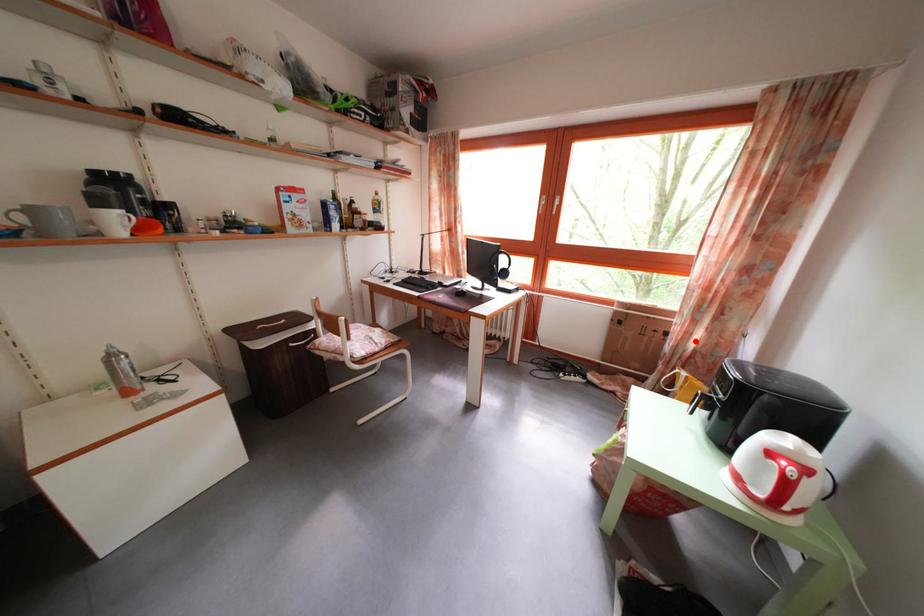
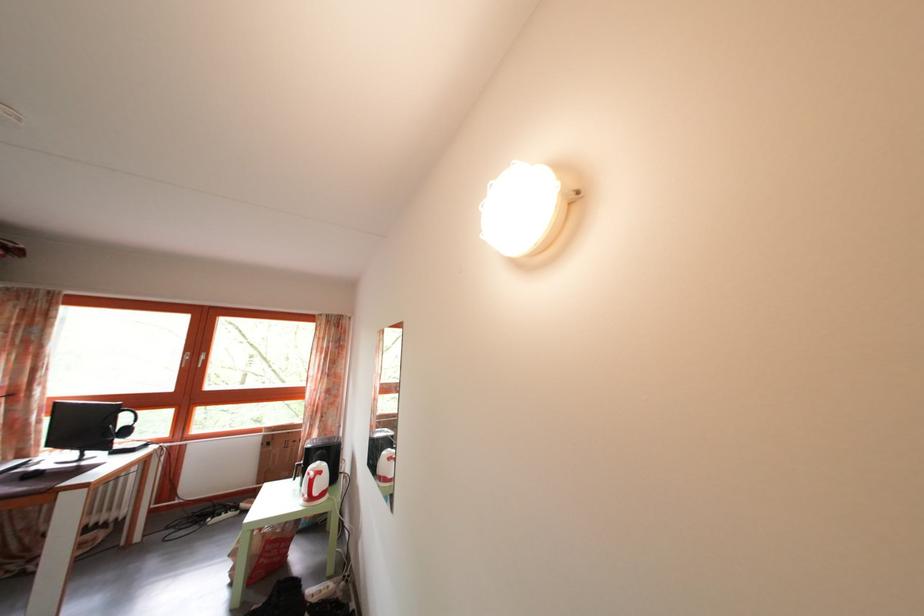
Where in the second image is the point corresponding to the highlighted location from the first image?

(317, 442)